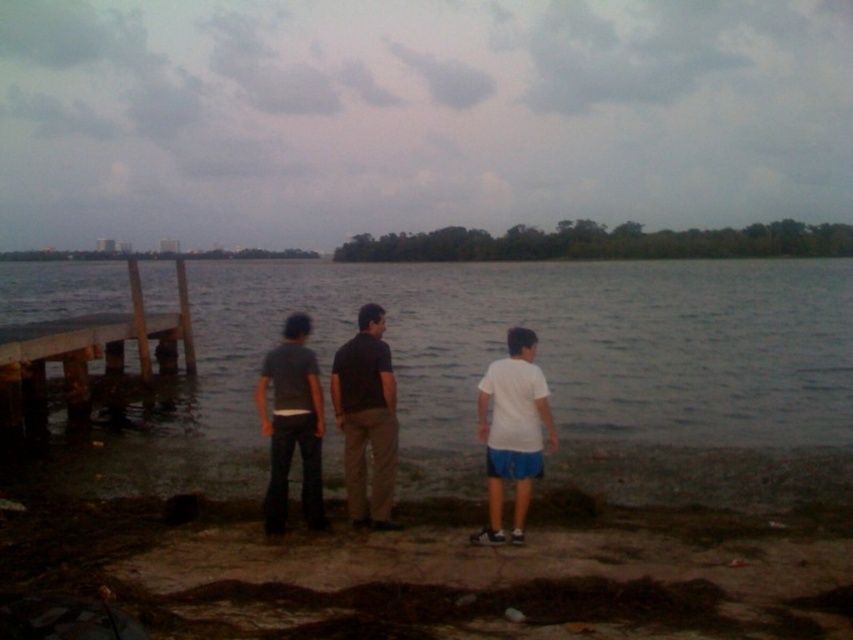
Can you confirm if brown dirt at lower center is positioned to the left of dark gray jeans at center?

In fact, brown dirt at lower center is to the right of dark gray jeans at center.

Can you confirm if brown dirt at lower center is positioned below dark gray jeans at center?

Indeed, brown dirt at lower center is positioned under dark gray jeans at center.

Does point (222, 524) come behind point (312, 381)?

That is True.

Locate an element on the screen. Image resolution: width=853 pixels, height=640 pixels. brown dirt at lower center is located at coordinates (428, 572).

Is dark gray cotton shirt at center positioned in front of brown wooden dock at left?

Yes, dark gray cotton shirt at center is closer to the viewer.

Does point (274, 426) lie in front of point (80, 413)?

Yes, it is.

Between point (281, 401) and point (25, 339), which one is positioned behind?

Positioned behind is point (25, 339).

Locate an element on the screen. The height and width of the screenshot is (640, 853). dark gray cotton shirt at center is located at coordinates (366, 416).

Is dark gray cotton shirt at center below dark brown cotton pants at center?

Incorrect, dark gray cotton shirt at center is not positioned below dark brown cotton pants at center.

What do you see at coordinates (366, 416) in the screenshot? The height and width of the screenshot is (640, 853). I see `dark gray cotton shirt at center` at bounding box center [366, 416].

Where is `dark gray cotton shirt at center`? dark gray cotton shirt at center is located at coordinates (366, 416).